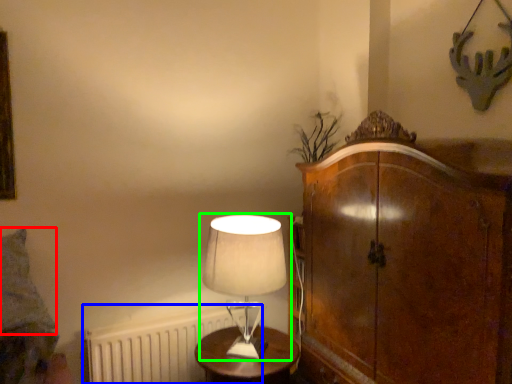
Question: Which is nearer to the pillow (highlighted by a red box)? radiator (highlighted by a blue box) or lamp (highlighted by a green box).

Choices:
 (A) radiator
 (B) lamp

Answer: (A)